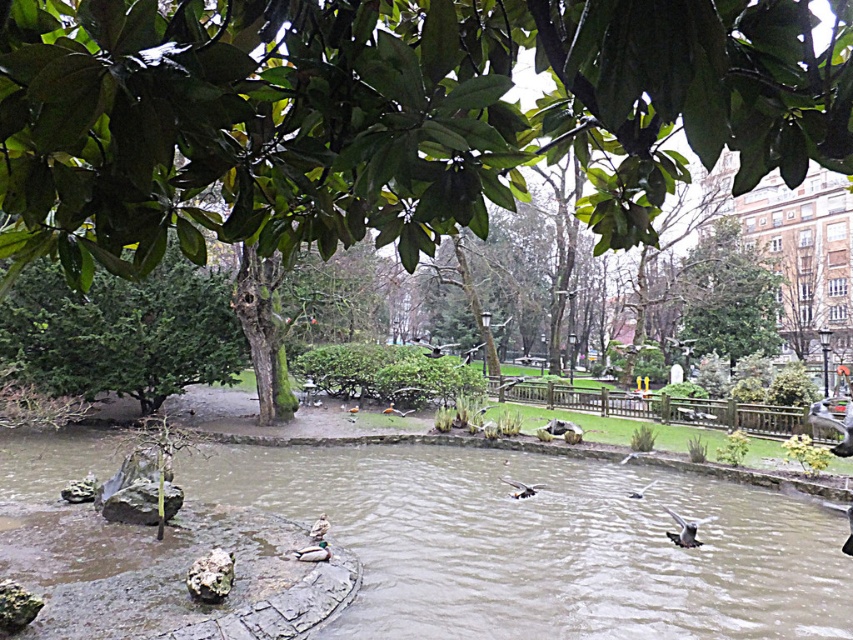
Question: From the image, what is the correct spatial relationship of green leafy tree at upper center in relation to white feathered bird at center?

Choices:
 (A) right
 (B) left

Answer: (B)

Question: Among these objects, which one is nearest to the camera?

Choices:
 (A) green textured tree at upper center
 (B) brown matte duck at center
 (C) white feathered bird at center

Answer: (B)

Question: Which point appears closest to the camera in this image?

Choices:
 (A) (636, 492)
 (B) (550, 547)
 (C) (320, 547)
 (D) (328, 525)

Answer: (C)

Question: Considering the relative positions of brown stone river at center and brown matte duck at center in the image provided, where is brown stone river at center located with respect to brown matte duck at center?

Choices:
 (A) below
 (B) above

Answer: (A)

Question: Which of the following is the farthest from the observer?

Choices:
 (A) pos(515,488)
 (B) pos(792,547)
 (C) pos(728,252)
 (D) pos(747,44)

Answer: (C)

Question: Is gray feathered bird at center above brown matte duck at center?

Choices:
 (A) no
 (B) yes

Answer: (A)